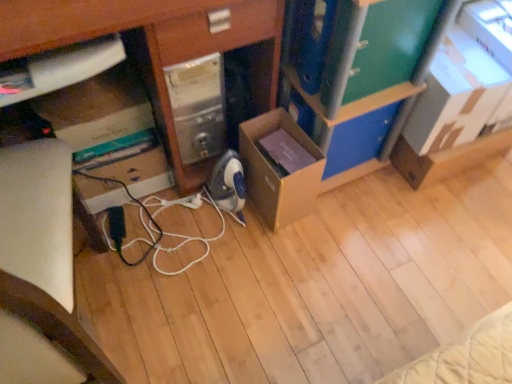
At what (x,y) coordinates should I click in order to perform the action: click on vacant area that is in front of black rubber cable at center. Please return your answer as a coordinate pair (x, y). The image size is (512, 384). Looking at the image, I should click on (175, 313).